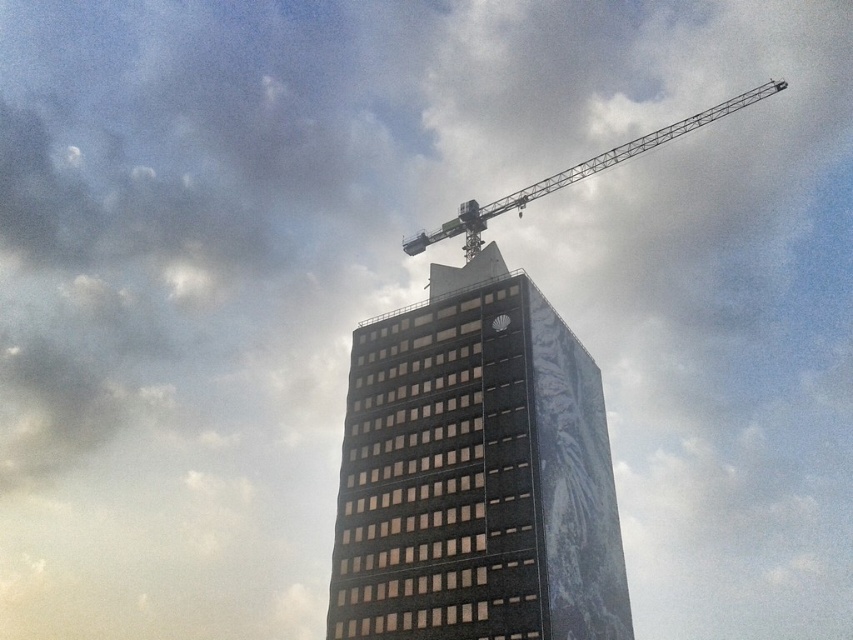
Consider the image. Between black glass building at center and metallic gray crane at upper right, which one is positioned lower?

Positioned lower is black glass building at center.

Who is taller, black glass building at center or metallic gray crane at upper right?

metallic gray crane at upper right is taller.

Measure the distance between point (624,627) and camera.

Point (624,627) and camera are 61.78 meters apart.

The width and height of the screenshot is (853, 640). I want to click on black glass building at center, so click(x=474, y=474).